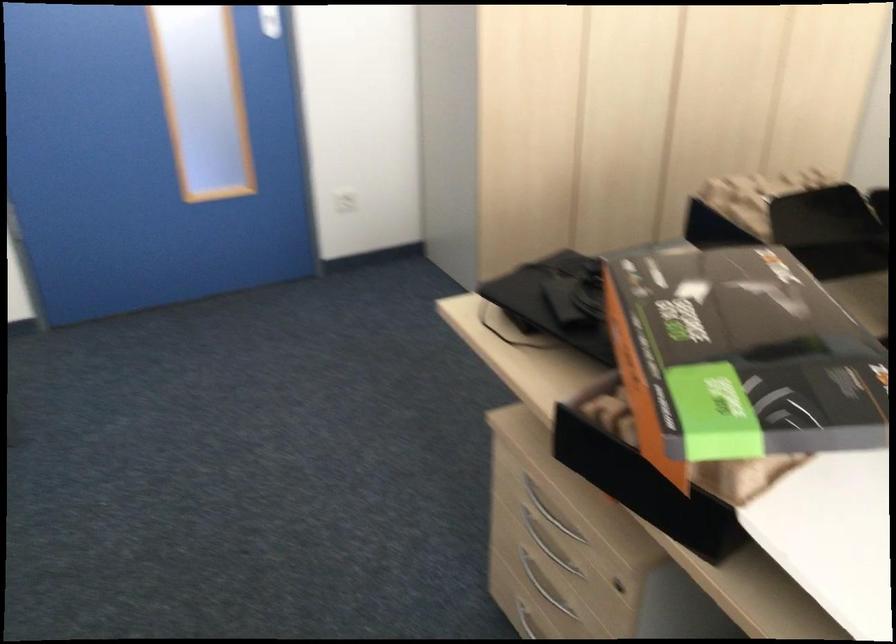
What do you see at coordinates (826, 222) in the screenshot? This screenshot has height=644, width=896. I see `the black box tray` at bounding box center [826, 222].